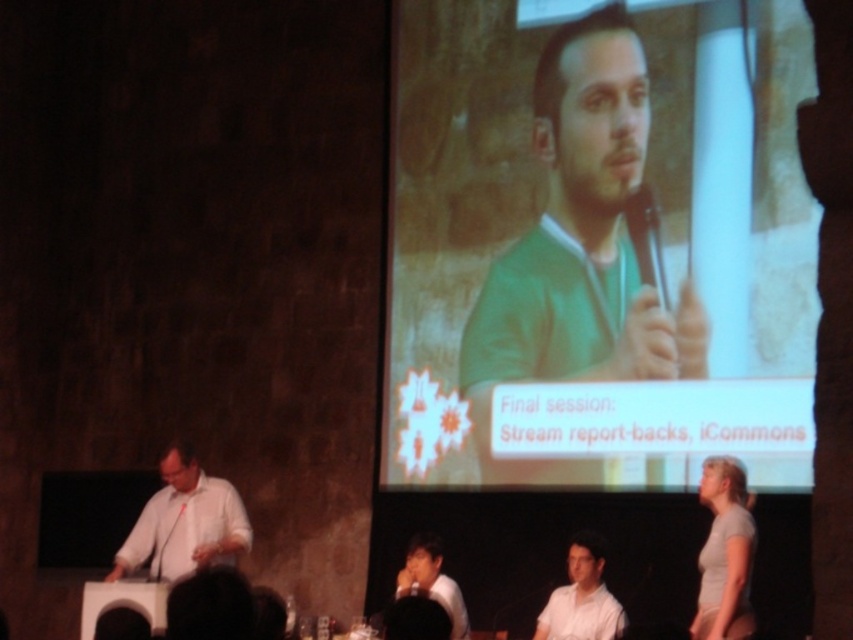
Question: Which object appears farthest from the camera in this image?

Choices:
 (A) green fabric at upper center
 (B) white matte shirt at center
 (C) white matte shirt at lower center

Answer: (A)

Question: Does green fabric at upper center appear on the right side of white matte shirt at left?

Choices:
 (A) yes
 (B) no

Answer: (A)

Question: Is white matte shirt at lower right positioned behind white matte shirt at lower center?

Choices:
 (A) yes
 (B) no

Answer: (A)

Question: Can you confirm if white matte shirt at center is wider than white matte shirt at lower center?

Choices:
 (A) yes
 (B) no

Answer: (B)

Question: Based on their relative distances, which object is farther from the white matte shirt at left?

Choices:
 (A) green fabric at upper center
 (B) white matte shirt at lower right
 (C) white matte shirt at lower center

Answer: (B)

Question: Which object appears farthest from the camera in this image?

Choices:
 (A) white matte shirt at lower right
 (B) green fabric at upper center
 (C) white matte shirt at center

Answer: (B)